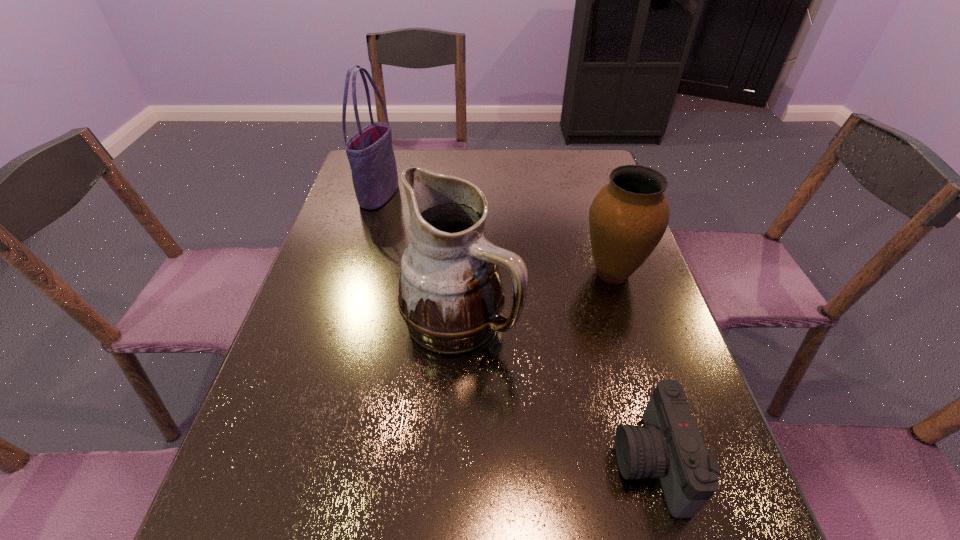
The image size is (960, 540). In the image, there is a desktop. What are the coordinates of `free space at the far right corner` in the screenshot? It's located at (564, 163).

This screenshot has width=960, height=540. Identify the location of free spot between the pitcher and the camera. (555, 391).

Where is `empty location between the farthest object and the nearest object`? The image size is (960, 540). empty location between the farthest object and the nearest object is located at coordinates pos(515,328).

What are the coordinates of `vacant region between the camera and the farthest object` in the screenshot? It's located at (515, 328).

Identify the location of vacant space in between the camera and the pitcher. (555, 391).

At what (x,y) coordinates should I click in order to perform the action: click on blank region between the shortest object and the urn. Please return your answer as a coordinate pair (x, y). This screenshot has width=960, height=540. Looking at the image, I should click on (631, 367).

Where is `unoccupied area between the camera and the pitcher`? The image size is (960, 540). unoccupied area between the camera and the pitcher is located at coordinates (555, 391).

Locate an element on the screen. The width and height of the screenshot is (960, 540). free space between the urn and the farthest object is located at coordinates (496, 234).

Find the location of `empty space that is in between the urn and the nearest object`. empty space that is in between the urn and the nearest object is located at coordinates (631, 367).

Where is `vacant point located between the shortest object and the pitcher`? This screenshot has height=540, width=960. vacant point located between the shortest object and the pitcher is located at coordinates (555, 391).